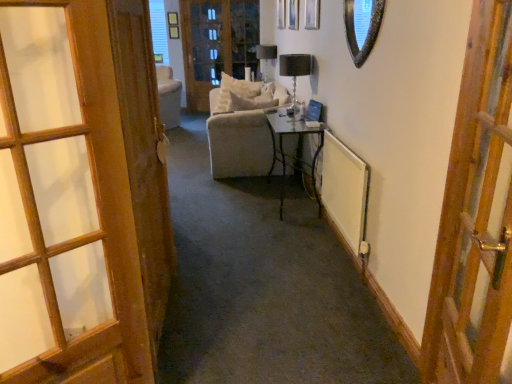
Question: From a real-world perspective, is wooden door at left, which is counted as the second door, starting from the right, beneath matte black table lamp at upper center, acting as the 1th table lamp starting from the back?

Choices:
 (A) yes
 (B) no

Answer: (A)

Question: Is there a large distance between wooden door at left, which appears as the second door when viewed from the left, and matte black table lamp at upper center, which ranks as the first table lamp in left-to-right order?

Choices:
 (A) yes
 (B) no

Answer: (A)

Question: Considering the relative positions of wooden door at left, which is counted as the second door, starting from the right, and matte black table lamp at upper center, which is the 1th table lamp from top to bottom, in the image provided, is wooden door at left, which is counted as the second door, starting from the right, to the right of matte black table lamp at upper center, which is the 1th table lamp from top to bottom, from the viewer's perspective?

Choices:
 (A) no
 (B) yes

Answer: (A)

Question: Considering the relative sizes of wooden door at left, which is counted as the second door, starting from the right, and matte black table lamp at upper center, acting as the 1th table lamp starting from the back, in the image provided, is wooden door at left, which is counted as the second door, starting from the right, shorter than matte black table lamp at upper center, acting as the 1th table lamp starting from the back,?

Choices:
 (A) no
 (B) yes

Answer: (A)

Question: Considering the relative positions of wooden door at left, which appears as the second door when viewed from the left, and matte black table lamp at upper center, which is the 2th table lamp in front-to-back order, in the image provided, is wooden door at left, which appears as the second door when viewed from the left, behind matte black table lamp at upper center, which is the 2th table lamp in front-to-back order,?

Choices:
 (A) no
 (B) yes

Answer: (A)

Question: In terms of width, does shiny silver mirror at upper right look wider or thinner when compared to matte black table lamp at upper center, the 2th table lamp ordered from the bottom?

Choices:
 (A) thin
 (B) wide

Answer: (A)

Question: In the image, is shiny silver mirror at upper right positioned in front of or behind matte black table lamp at upper center, which is the second table lamp in right-to-left order?

Choices:
 (A) front
 (B) behind

Answer: (A)

Question: Based on their positions, is shiny silver mirror at upper right located to the left or right of matte black table lamp at upper center, acting as the 1th table lamp starting from the back?

Choices:
 (A) right
 (B) left

Answer: (A)

Question: Considering the positions of point (351, 21) and point (271, 59), is point (351, 21) closer or farther from the camera than point (271, 59)?

Choices:
 (A) closer
 (B) farther

Answer: (A)

Question: Considering the positions of clear glass table at center and clear glass screen door at upper center in the image, is clear glass table at center wider or thinner than clear glass screen door at upper center?

Choices:
 (A) wide
 (B) thin

Answer: (A)

Question: Is clear glass table at center to the left or to the right of clear glass screen door at upper center in the image?

Choices:
 (A) right
 (B) left

Answer: (A)

Question: From a real-world perspective, is clear glass table at center positioned above or below clear glass screen door at upper center?

Choices:
 (A) above
 (B) below

Answer: (B)

Question: Would you say clear glass table at center is inside or outside clear glass screen door at upper center?

Choices:
 (A) outside
 (B) inside

Answer: (A)

Question: In terms of width, does matte black table lamp at upper center, the 2th table lamp ordered from the bottom, look wider or thinner when compared to white soft pillow at center?

Choices:
 (A) thin
 (B) wide

Answer: (A)

Question: Is matte black table lamp at upper center, the 2th table lamp ordered from the bottom, inside or outside of white soft pillow at center?

Choices:
 (A) inside
 (B) outside

Answer: (B)